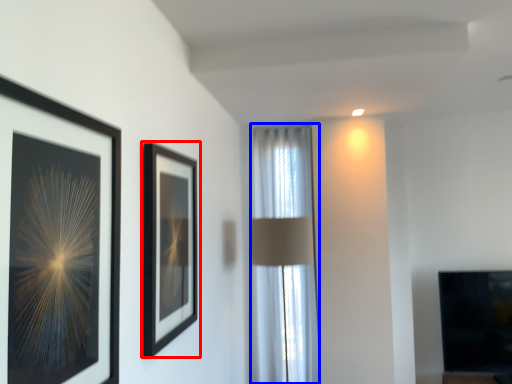
Question: Which object appears farthest to the camera in this image, picture frame (highlighted by a red box) or curtain (highlighted by a blue box)?

Choices:
 (A) picture frame
 (B) curtain

Answer: (B)